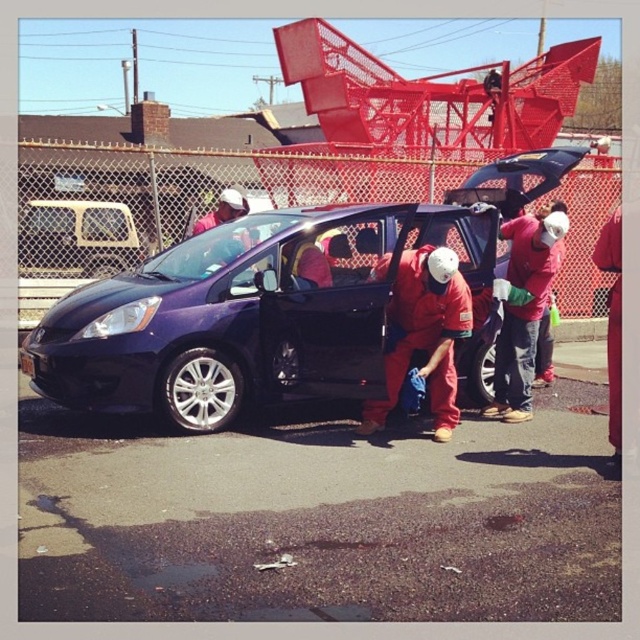
Question: Which of the following is the closest to the observer?

Choices:
 (A) matte red shirt at center
 (B) purple matte car at center

Answer: (B)

Question: Which point is closer to the camera taking this photo?

Choices:
 (A) (29, 280)
 (B) (323, 280)
 (C) (216, 211)
 (D) (612, 308)

Answer: (D)

Question: Can you confirm if metallic silver minivan at left is bigger than red fabric jacket at center?

Choices:
 (A) no
 (B) yes

Answer: (B)

Question: Which point is closer to the camera taking this photo?

Choices:
 (A) (332, 230)
 (B) (80, 268)
 (C) (195, 227)
 (D) (600, 234)

Answer: (A)

Question: Can you confirm if metallic silver minivan at left is positioned to the right of matte red shirt at center?

Choices:
 (A) yes
 (B) no

Answer: (B)

Question: Can you confirm if purple matte car at center is wider than metallic silver minivan at left?

Choices:
 (A) yes
 (B) no

Answer: (A)